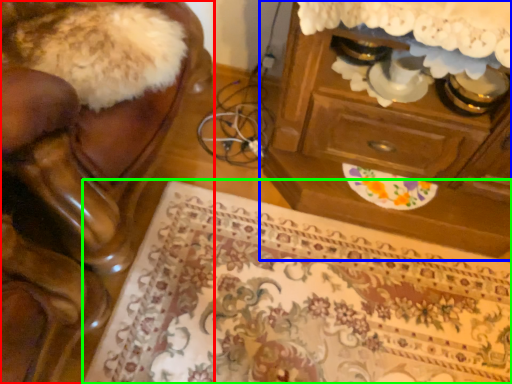
Question: Based on their relative distances, which object is farther from furniture (highlighted by a red box)? Choose from chest of drawers (highlighted by a blue box) and mat (highlighted by a green box).

Choices:
 (A) chest of drawers
 (B) mat

Answer: (A)